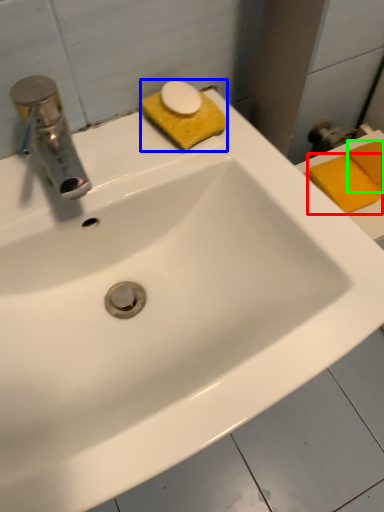
Question: Estimate the real-world distances between objects in this image. Which object is farther from soap (highlighted by a red box), soap (highlighted by a blue box) or soap (highlighted by a green box)?

Choices:
 (A) soap
 (B) soap

Answer: (A)